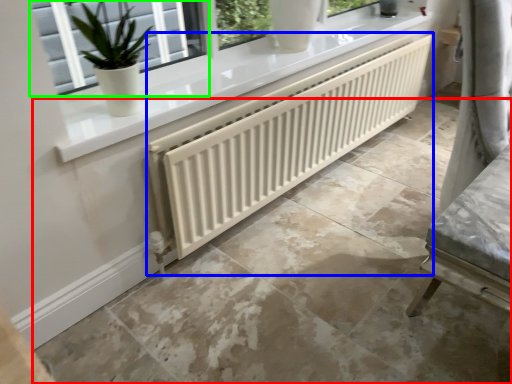
Question: Considering the real-world distances, which object is closest to concrete (highlighted by a red box)? radiator (highlighted by a blue box) or window (highlighted by a green box).

Choices:
 (A) radiator
 (B) window

Answer: (A)